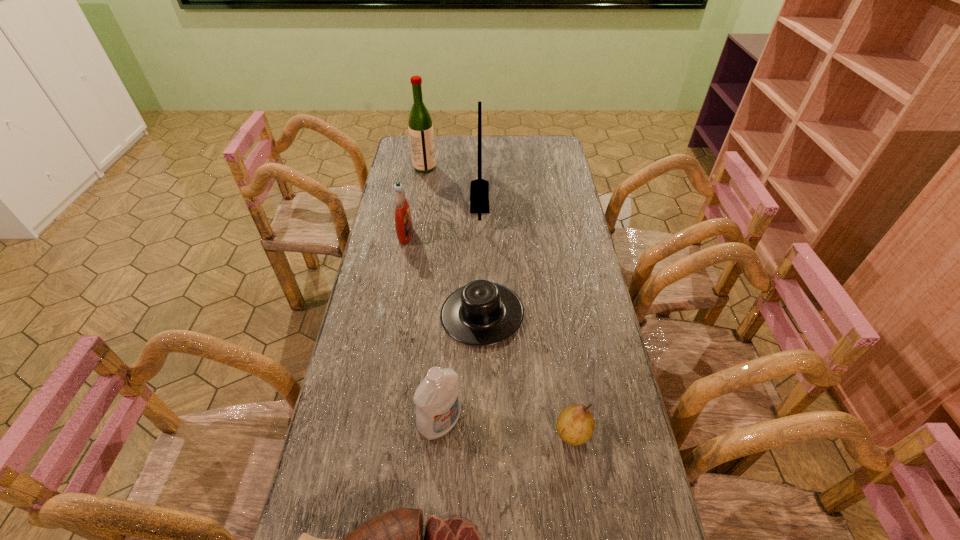
The width and height of the screenshot is (960, 540). I want to click on object that is the second closest to the left detergent, so click(481, 313).

Identify which object is the second nearest to the liquor. Please provide its 2D coordinates. Your answer should be formatted as a tuple, i.e. [(x, y)], where the tuple contains the x and y coordinates of a point satisfying the conditions above.

[(403, 220)]

Locate an element on the screen. The image size is (960, 540). vacant space that satisfies the following two spatial constraints: 1. on the label of the tallest object; 2. on the right side of the right detergent is located at coordinates (384, 423).

Identify the location of free region that satisfies the following two spatial constraints: 1. on the front side of the pear; 2. on the left side of the nearer detergent. Image resolution: width=960 pixels, height=540 pixels. (440, 432).

Locate an element on the screen. This screenshot has height=540, width=960. vacant area that satisfies the following two spatial constraints: 1. on the label of the liquor; 2. on the right side of the right detergent is located at coordinates (384, 423).

The width and height of the screenshot is (960, 540). I want to click on free location that satisfies the following two spatial constraints: 1. on the front-facing side of the monitor; 2. on the back side of the dress hat, so click(480, 314).

Locate an element on the screen. The width and height of the screenshot is (960, 540). free location that satisfies the following two spatial constraints: 1. on the label of the tallest object; 2. on the right side of the rightmost object is located at coordinates (383, 432).